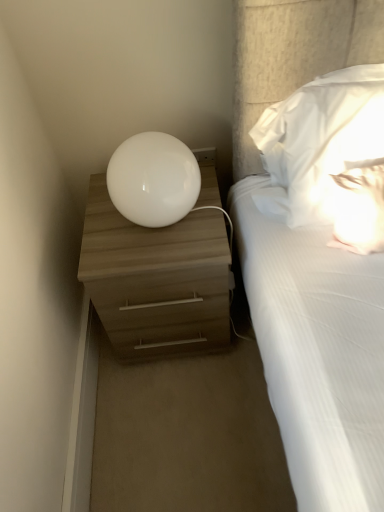
Question: Is white soft pillow at upper right to the left of white glossy sphere at upper center from the viewer's perspective?

Choices:
 (A) no
 (B) yes

Answer: (A)

Question: From a real-world perspective, is white soft pillow at upper right positioned under white glossy sphere at upper center based on gravity?

Choices:
 (A) no
 (B) yes

Answer: (A)

Question: Can you confirm if white soft pillow at upper right is wider than white glossy sphere at upper center?

Choices:
 (A) no
 (B) yes

Answer: (A)

Question: Is white soft pillow at upper right not within white glossy sphere at upper center?

Choices:
 (A) no
 (B) yes

Answer: (B)

Question: Can you see white soft pillow at upper right touching white glossy sphere at upper center?

Choices:
 (A) yes
 (B) no

Answer: (B)

Question: From the image's perspective, is white soft pillow at upper right below white glossy sphere at upper center?

Choices:
 (A) no
 (B) yes

Answer: (A)

Question: Does white glossy sphere at upper center have a greater height compared to white soft pillow at upper right?

Choices:
 (A) no
 (B) yes

Answer: (A)

Question: Is white glossy sphere at upper center completely or partially outside of white soft pillow at upper right?

Choices:
 (A) yes
 (B) no

Answer: (A)

Question: From a real-world perspective, does white glossy sphere at upper center sit lower than white soft pillow at upper right?

Choices:
 (A) no
 (B) yes

Answer: (B)

Question: Is white glossy sphere at upper center positioned far away from white soft pillow at upper right?

Choices:
 (A) no
 (B) yes

Answer: (A)

Question: Considering the relative sizes of white glossy sphere at upper center and white soft pillow at upper right in the image provided, is white glossy sphere at upper center smaller than white soft pillow at upper right?

Choices:
 (A) no
 (B) yes

Answer: (B)

Question: Is the position of white glossy sphere at upper center less distant than that of white soft pillow at upper right?

Choices:
 (A) yes
 (B) no

Answer: (B)

Question: From the image's perspective, is matte wood nightstand at left below white soft pillow at upper right?

Choices:
 (A) no
 (B) yes

Answer: (B)